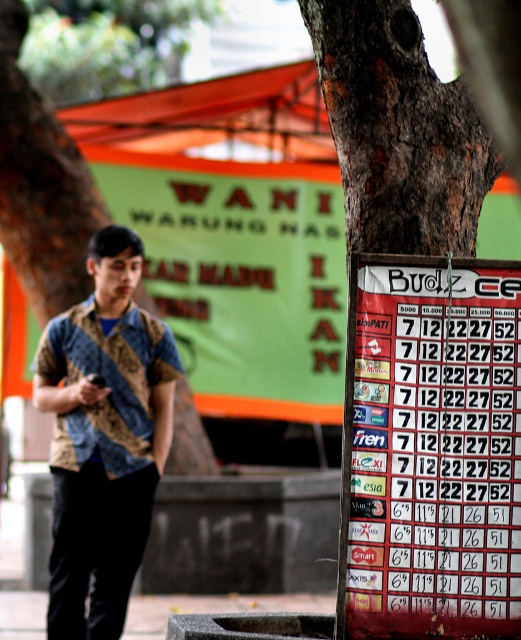
Question: Observing the image, what is the correct spatial positioning of red paper poster at right in reference to gray concrete pavement at lower left?

Choices:
 (A) above
 (B) below

Answer: (A)

Question: Which object is the farthest from the camouflage fabric shirt at left?

Choices:
 (A) batik shirt at left
 (B) brown rough bark tree at left
 (C) gray concrete pavement at lower left
 (D) red paper poster at right

Answer: (D)

Question: Among these objects, which one is nearest to the camera?

Choices:
 (A) brown rough bark at upper center
 (B) brown rough bark tree at left
 (C) batik shirt at left
 (D) red paper poster at right

Answer: (D)

Question: Can you confirm if brown rough bark at upper center is smaller than camouflage fabric shirt at left?

Choices:
 (A) no
 (B) yes

Answer: (A)

Question: Where is brown rough bark tree at left located in relation to camouflage fabric shirt at left in the image?

Choices:
 (A) above
 (B) below

Answer: (A)

Question: Which of the following is the closest to the observer?

Choices:
 (A) (490, 90)
 (B) (118, 256)
 (C) (13, 179)

Answer: (A)